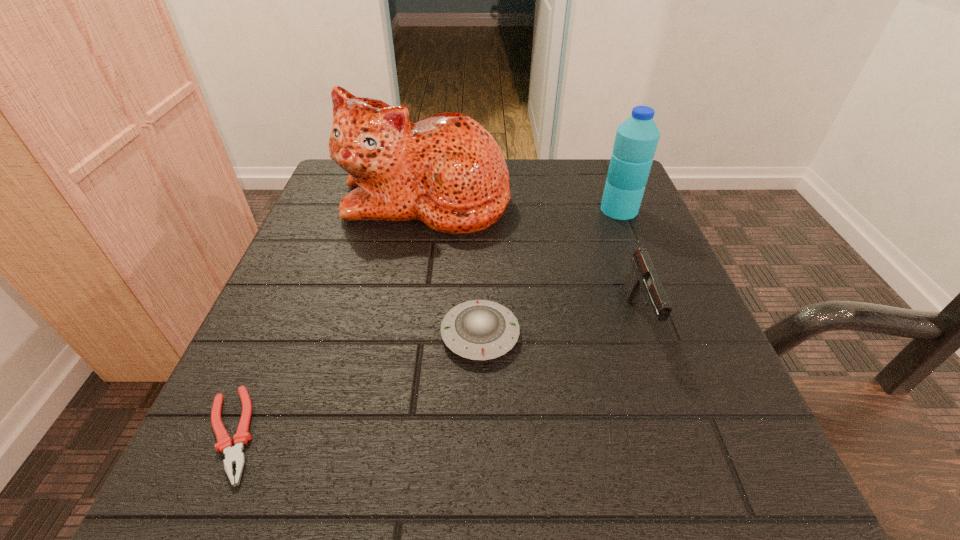
I want to click on free space located on the right of the shortest object, so click(x=514, y=434).

I want to click on cat at the far edge, so click(446, 170).

This screenshot has height=540, width=960. Identify the location of water bottle located at the far edge. (636, 140).

Identify the location of object present at the near edge. This screenshot has width=960, height=540. (233, 454).

Locate an element on the screen. The height and width of the screenshot is (540, 960). cat at the left edge is located at coordinates (446, 170).

Identify the location of pliers that is at the left edge. This screenshot has width=960, height=540. (233, 454).

The width and height of the screenshot is (960, 540). I want to click on water bottle positioned at the right edge, so click(636, 140).

Locate an element on the screen. The width and height of the screenshot is (960, 540). pistol located at the right edge is located at coordinates (643, 280).

The image size is (960, 540). What are the coordinates of `object positioned at the far left corner` in the screenshot? It's located at (446, 170).

Identify the location of object located at the near left corner. The image size is (960, 540). (233, 454).